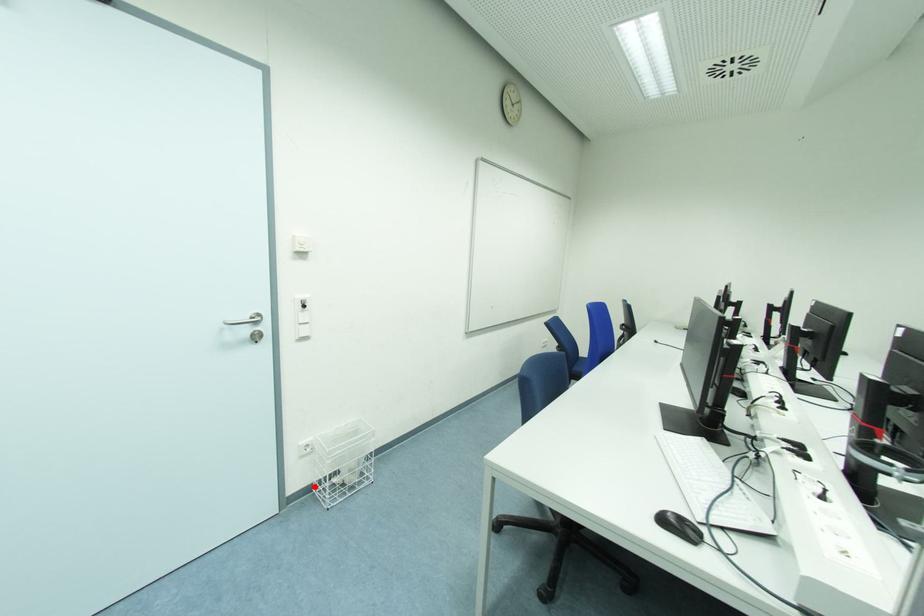
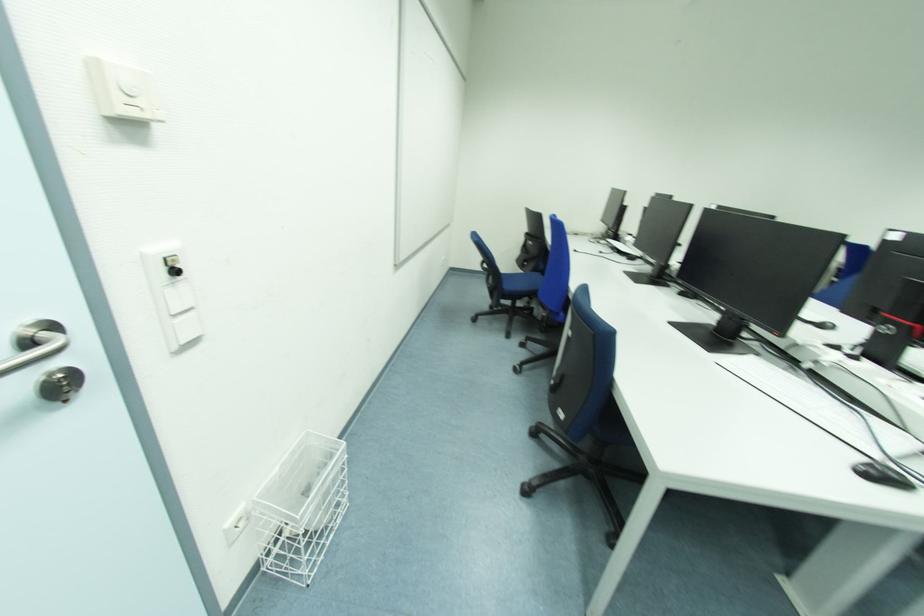
Question: A red point is marked in image1. In image2, is the corresponding 3D point closer to the camera or farther? Reply with the corresponding letter.

Choices:
 (A) The corresponding 3D point is closer.
 (B) The corresponding 3D point is farther.

Answer: (A)